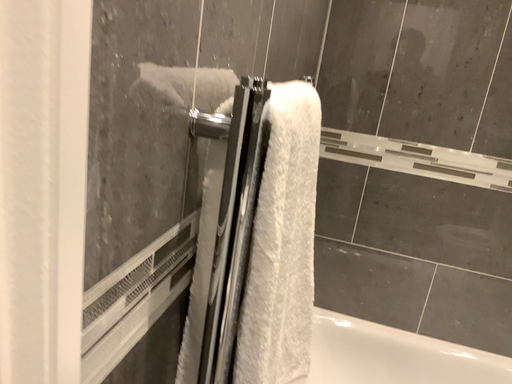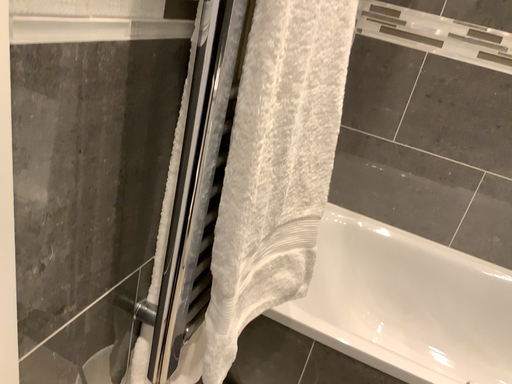
Question: How did the camera likely rotate when shooting the video?

Choices:
 (A) rotated left
 (B) rotated right

Answer: (A)